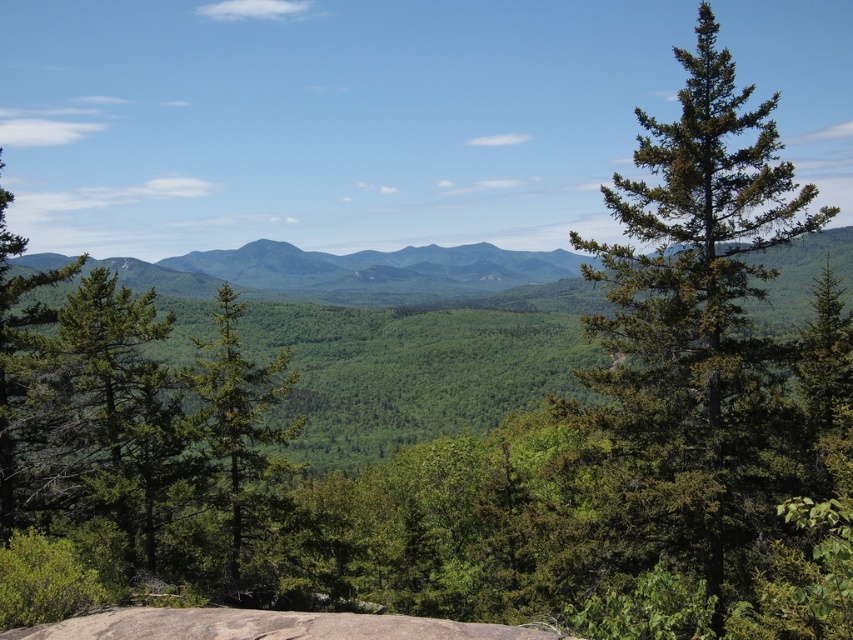
This screenshot has height=640, width=853. Describe the element at coordinates (717, 353) in the screenshot. I see `green needle-like at right` at that location.

Does green needle-like at right appear on the right side of gray rock at lower center?

Indeed, green needle-like at right is positioned on the right side of gray rock at lower center.

Who is more forward, (795, 493) or (331, 634)?

Positioned in front is point (331, 634).

Find the location of a particular element. The height and width of the screenshot is (640, 853). green needle-like at right is located at coordinates (717, 353).

Is point (746, 344) farther from viewer compared to point (196, 387)?

That is False.

Can you confirm if green needle-like at right is thinner than green matte tree at center?

In fact, green needle-like at right might be wider than green matte tree at center.

Which is behind, point (722, 148) or point (227, 472)?

The point (227, 472) is behind.

Image resolution: width=853 pixels, height=640 pixels. What are the coordinates of `green needle-like at right` in the screenshot? It's located at pyautogui.click(x=717, y=353).

Does green forested mountain at center have a lesser width compared to green matte tree at center?

In fact, green forested mountain at center might be wider than green matte tree at center.

Is green forested mountain at center taller than green matte tree at center?

Indeed, green forested mountain at center has a greater height compared to green matte tree at center.

Is point (512, 266) positioned in front of point (282, 358)?

No, (512, 266) is behind (282, 358).

Where is `green forested mountain at center`? The height and width of the screenshot is (640, 853). green forested mountain at center is located at coordinates (370, 275).